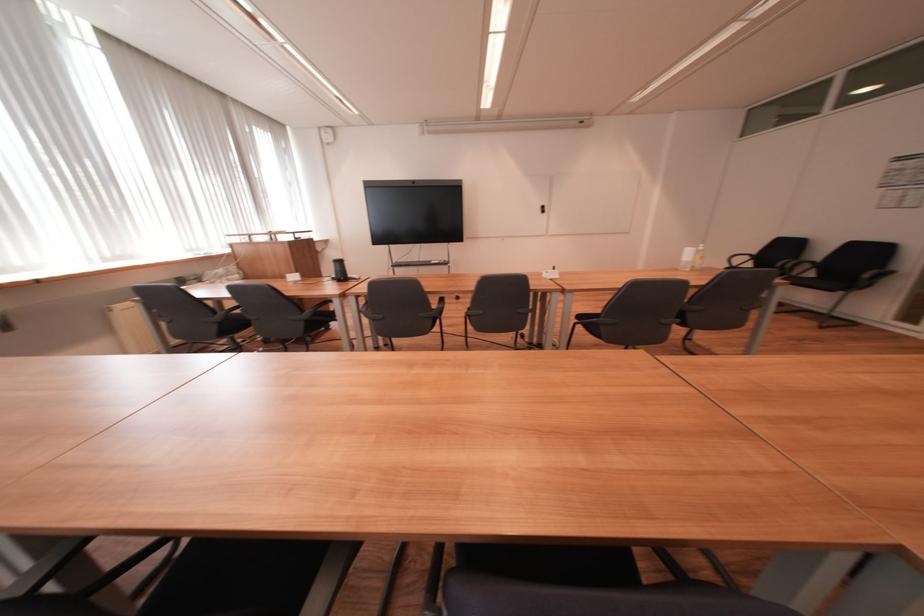
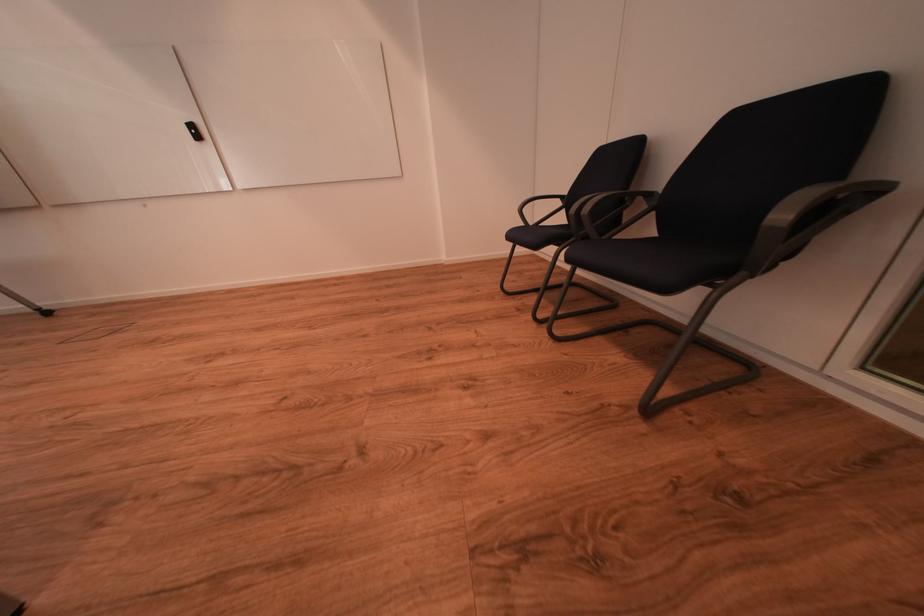
In a continuous first-person perspective shot, in which direction is the camera moving?

The cameraman moved toward right, forward.